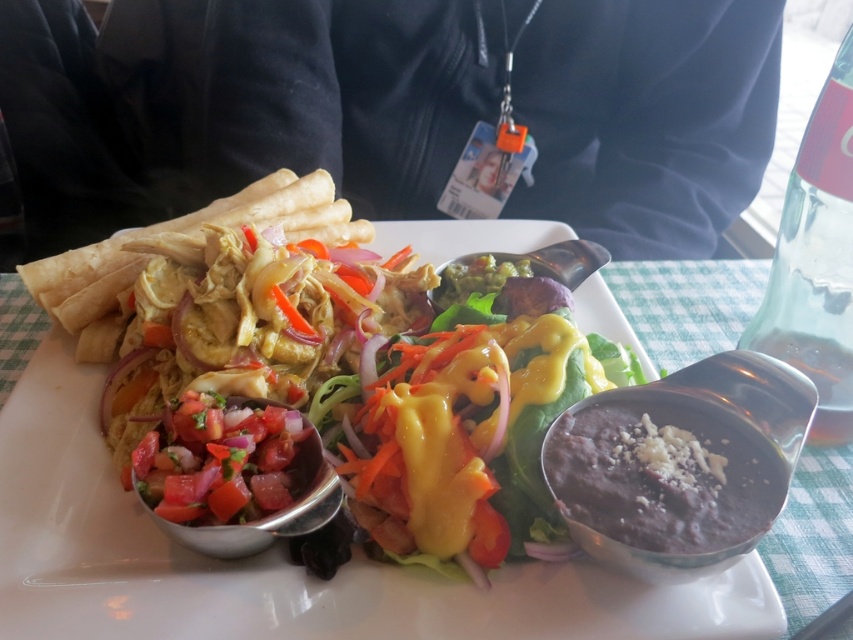
You are a food critic evaluating the presentation of this dish. The plate has a fresh green salad at center and a sliced tomato salad at center. Which salad takes up more space horizontally on the plate?

The fresh green salad at center has a larger width than the sliced tomato salad at center, so it takes up more horizontal space on the plate.

Looking at this image, looking at the plate with the fresh green salad at center and the sliced tomato salad at center, which salad is positioned more to the left?

The sliced tomato salad at center is more to the left since the fresh green salad at center is to its right.